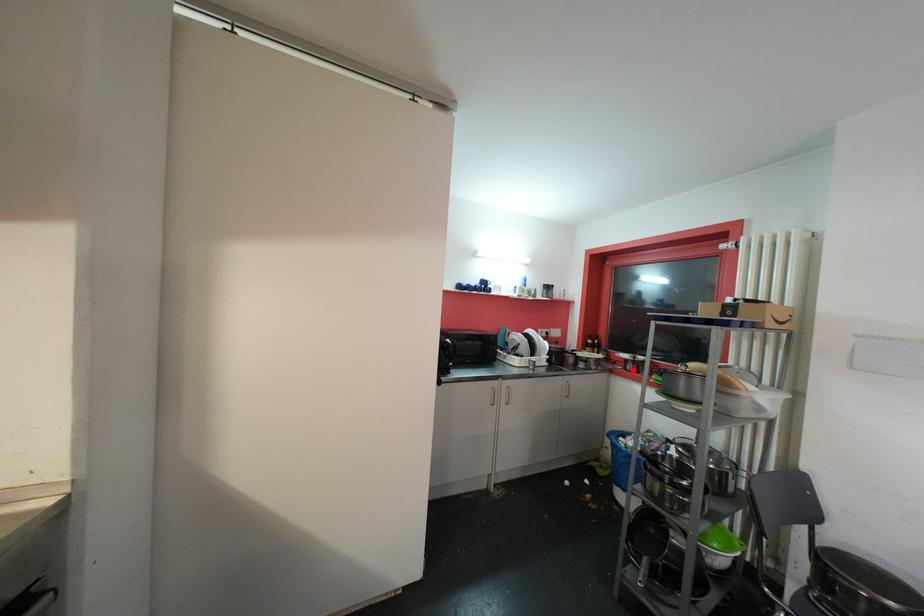
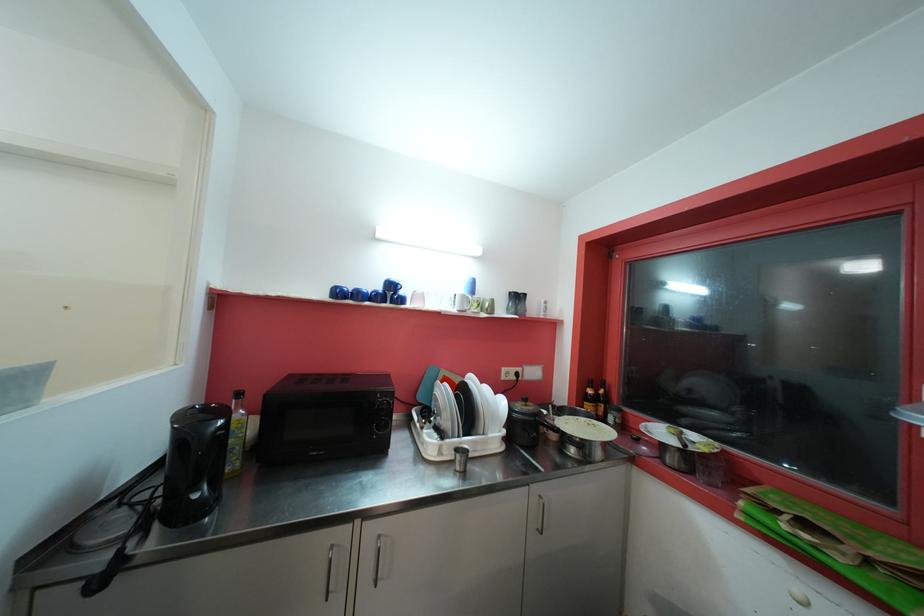
In the second image, find the point that corresponds to the highlighted location in the first image.

(675, 462)